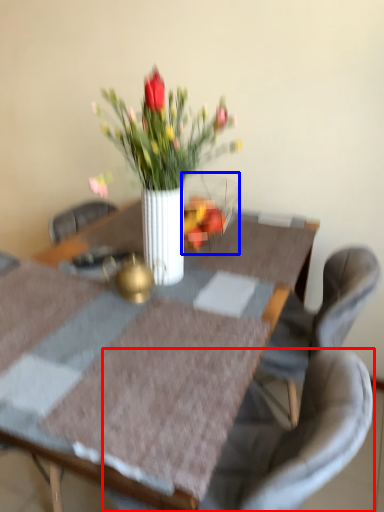
Question: Among these objects, which one is nearest to the camera, chair (highlighted by a red box) or glass vase (highlighted by a blue box)?

Choices:
 (A) chair
 (B) glass vase

Answer: (A)